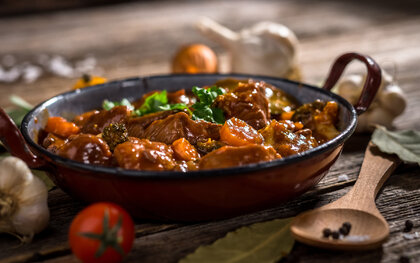
Locate an element on the screen. skillet is located at coordinates (352, 123).